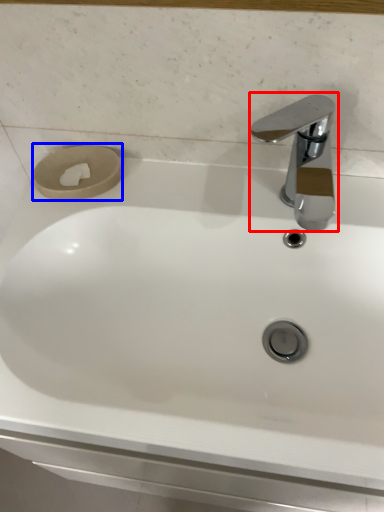
Question: Which point is further to the camera, tap (highlighted by a red box) or toilet paper (highlighted by a blue box)?

Choices:
 (A) tap
 (B) toilet paper

Answer: (B)